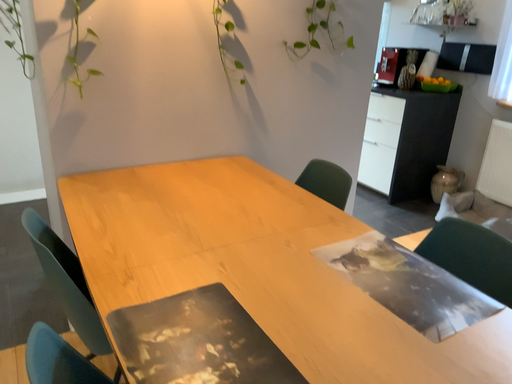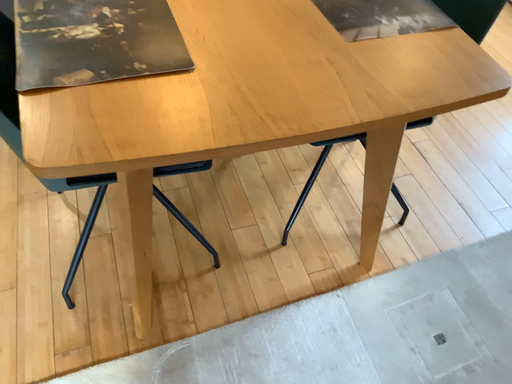
Question: Which way did the camera rotate in the video?

Choices:
 (A) rotated upward
 (B) rotated downward

Answer: (B)